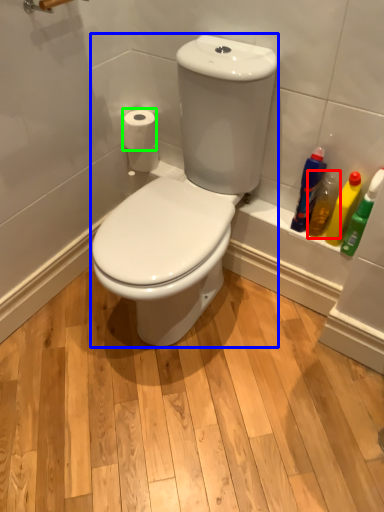
Question: Estimate the real-world distances between objects in this image. Which object is closer to cleaning product (highlighted by a red box), sit (highlighted by a blue box) or toilet paper (highlighted by a green box)?

Choices:
 (A) sit
 (B) toilet paper

Answer: (A)